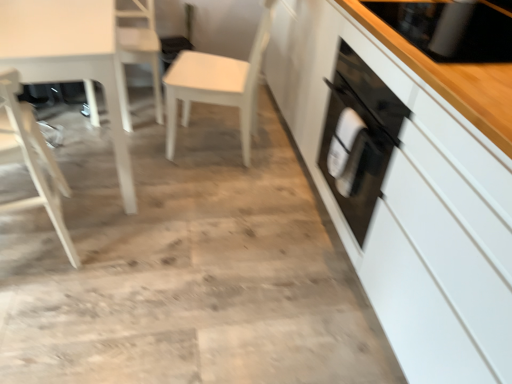
Locate an element on the screen. white wood chair at left, which appears as the third chair when viewed from the right is located at coordinates (31, 158).

Identify the location of white wood chair at upper left, the 2th chair when ordered from left to right. (142, 46).

This screenshot has height=384, width=512. I want to click on black glass stove at upper right, so click(x=450, y=28).

How far apart are white glossy table at left and black glass stove at upper right?

1.14 meters.

From the image's perspective, which one is positioned higher, white glossy table at left or black glass stove at upper right?

black glass stove at upper right is shown above in the image.

Where is `table on the left of black glass stove at upper right`? This screenshot has width=512, height=384. table on the left of black glass stove at upper right is located at coordinates (69, 57).

Which object is further away from the camera taking this photo, white glossy table at left or black glass stove at upper right?

white glossy table at left is further away from the camera.

In the scene shown: From a real-world perspective, is white wood chair at upper left, positioned as the 2th chair in right-to-left order, on white glossy cabinet at right?

No.

What's the angular difference between white wood chair at upper left, the 2th chair when ordered from left to right, and white glossy cabinet at right's facing directions?

The facing directions of white wood chair at upper left, the 2th chair when ordered from left to right, and white glossy cabinet at right are 90.7 degrees apart.

Who is shorter, white wood chair at upper left, positioned as the 2th chair in right-to-left order, or white glossy cabinet at right?

With less height is white wood chair at upper left, positioned as the 2th chair in right-to-left order.

Is point (495, 7) positioned before point (173, 143)?

Yes, it is in front of point (173, 143).

Where is `appliance in front of the white matte chair at center, which is the third chair in left-to-right order`? This screenshot has height=384, width=512. appliance in front of the white matte chair at center, which is the third chair in left-to-right order is located at coordinates (450, 28).

Choose the correct answer: Is black glass stove at upper right inside white matte chair at center, which is the third chair in left-to-right order, or outside it?

black glass stove at upper right cannot be found inside white matte chair at center, which is the third chair in left-to-right order.

What are the coordinates of `chair that is the 1st object located in front of the white wood chair at upper left, positioned as the 2th chair in right-to-left order` in the screenshot? It's located at (217, 85).

Is white wood chair at upper left, positioned as the 2th chair in right-to-left order, taller than white matte chair at center, which is the third chair in left-to-right order?

No, white wood chair at upper left, positioned as the 2th chair in right-to-left order, is not taller than white matte chair at center, which is the third chair in left-to-right order.

Is white wood chair at upper left, positioned as the 2th chair in right-to-left order, far away from white matte chair at center, the 1th chair viewed from the right?

white wood chair at upper left, positioned as the 2th chair in right-to-left order, is actually quite close to white matte chair at center, the 1th chair viewed from the right.

From a real-world perspective, is white wood chair at upper left, the 2th chair when ordered from left to right, beneath white matte chair at center, the 1th chair viewed from the right?

Yes, from a real-world perspective, white wood chair at upper left, the 2th chair when ordered from left to right, is below white matte chair at center, the 1th chair viewed from the right.

What's the angular difference between white glossy table at left and white wood chair at upper left, the 2th chair when ordered from left to right,'s facing directions?

white glossy table at left and white wood chair at upper left, the 2th chair when ordered from left to right, are facing 3.49 degrees away from each other.

Looking at this image, from a real-world perspective, is white glossy table at left physically below white wood chair at upper left, positioned as the 2th chair in right-to-left order?

Actually, white glossy table at left is physically above white wood chair at upper left, positioned as the 2th chair in right-to-left order, in the real world.

Which of these two, white glossy table at left or white wood chair at upper left, the 2th chair when ordered from left to right, stands shorter?

Standing shorter between the two is white wood chair at upper left, the 2th chair when ordered from left to right.

Between white glossy table at left and white wood chair at upper left, the 2th chair when ordered from left to right, which one has smaller size?

white wood chair at upper left, the 2th chair when ordered from left to right, is smaller.

Looking at this image, from the image's perspective, is white wood chair at upper left, positioned as the 2th chair in right-to-left order, above or below white wood chair at left, which appears as the third chair when viewed from the right?

From the image's perspective, white wood chair at upper left, positioned as the 2th chair in right-to-left order, appears above white wood chair at left, which appears as the third chair when viewed from the right.

Considering the points (132, 14) and (3, 107), which point is in front, point (132, 14) or point (3, 107)?

Point (3, 107)

Is the depth of white wood chair at upper left, the 2th chair when ordered from left to right, greater than that of white wood chair at left, which appears as the third chair when viewed from the right?

Yes.

Is white wood chair at upper left, positioned as the 2th chair in right-to-left order, inside or outside of white wood chair at left, which appears as the third chair when viewed from the right?

white wood chair at upper left, positioned as the 2th chair in right-to-left order, exists outside the volume of white wood chair at left, which appears as the third chair when viewed from the right.

From the picture: Could you measure the distance between white wood chair at left, positioned as the first chair in left-to-right order, and white glossy cabinet at right?

white wood chair at left, positioned as the first chair in left-to-right order, and white glossy cabinet at right are 1.21 meters apart.

Is white wood chair at left, positioned as the first chair in left-to-right order, turned away from white glossy cabinet at right?

No, white glossy cabinet at right is not at the back of white wood chair at left, positioned as the first chair in left-to-right order.

Who is more distant, white wood chair at left, positioned as the first chair in left-to-right order, or white glossy cabinet at right?

white wood chair at left, positioned as the first chair in left-to-right order, is behind.

Is white wood chair at left, which appears as the third chair when viewed from the right, touching white glossy cabinet at right?

No, white wood chair at left, which appears as the third chair when viewed from the right, is not with white glossy cabinet at right.

Locate an element on the screen. The image size is (512, 384). appliance in front of the white glossy table at left is located at coordinates (450, 28).

From the image's perspective, count 2nd chairs upward from the white glossy cabinet at right and point to it. Please provide its 2D coordinates.

[(142, 46)]

From the image, which object appears to be nearer to white glossy table at left, white matte chair at center, which is the third chair in left-to-right order, or white wood chair at left, which appears as the third chair when viewed from the right?

white wood chair at left, which appears as the third chair when viewed from the right.

From the image, which object appears to be farther from white wood chair at upper left, positioned as the 2th chair in right-to-left order, white glossy cabinet at right or black glass stove at upper right?

Based on the image, black glass stove at upper right appears to be further to white wood chair at upper left, positioned as the 2th chair in right-to-left order.

From the image, which object appears to be farther from white matte chair at center, which is the third chair in left-to-right order, white wood chair at left, which appears as the third chair when viewed from the right, or black glass stove at upper right?

Among the two, white wood chair at left, which appears as the third chair when viewed from the right, is located further to white matte chair at center, which is the third chair in left-to-right order.

Estimate the real-world distances between objects in this image. Which object is further from white wood chair at left, positioned as the first chair in left-to-right order, white matte chair at center, the 1th chair viewed from the right, or white glossy cabinet at right?

Based on the image, white glossy cabinet at right appears to be further to white wood chair at left, positioned as the first chair in left-to-right order.

Which object lies further to the anchor point black glass stove at upper right, white glossy table at left or white wood chair at left, positioned as the first chair in left-to-right order?

white wood chair at left, positioned as the first chair in left-to-right order.

When comparing their distances from white wood chair at left, which appears as the third chair when viewed from the right, does white glossy cabinet at right or white wood chair at upper left, positioned as the 2th chair in right-to-left order, seem closer?

Among the two, white wood chair at upper left, positioned as the 2th chair in right-to-left order, is located nearer to white wood chair at left, which appears as the third chair when viewed from the right.

Estimate the real-world distances between objects in this image. Which object is closer to white glossy table at left, black glass stove at upper right or white wood chair at upper left, the 2th chair when ordered from left to right?

The object closer to white glossy table at left is white wood chair at upper left, the 2th chair when ordered from left to right.

From the image, which object appears to be farther from black glass stove at upper right, white wood chair at left, which appears as the third chair when viewed from the right, or white glossy cabinet at right?

white wood chair at left, which appears as the third chair when viewed from the right, is further to black glass stove at upper right.

Where is `appliance between white glossy cabinet at right and white matte chair at center, which is the third chair in left-to-right order, from front to back`? Image resolution: width=512 pixels, height=384 pixels. appliance between white glossy cabinet at right and white matte chair at center, which is the third chair in left-to-right order, from front to back is located at coordinates (450, 28).

Where is `table between white wood chair at left, which appears as the third chair when viewed from the right, and white wood chair at upper left, positioned as the 2th chair in right-to-left order, from front to back`? The width and height of the screenshot is (512, 384). table between white wood chair at left, which appears as the third chair when viewed from the right, and white wood chair at upper left, positioned as the 2th chair in right-to-left order, from front to back is located at coordinates (69, 57).

Where is `chair situated between white wood chair at upper left, the 2th chair when ordered from left to right, and black glass stove at upper right from left to right`? chair situated between white wood chair at upper left, the 2th chair when ordered from left to right, and black glass stove at upper right from left to right is located at coordinates (217, 85).

Where is `cabinetry situated between white wood chair at left, which appears as the third chair when viewed from the right, and black glass stove at upper right from left to right`? Image resolution: width=512 pixels, height=384 pixels. cabinetry situated between white wood chair at left, which appears as the third chair when viewed from the right, and black glass stove at upper right from left to right is located at coordinates (407, 181).